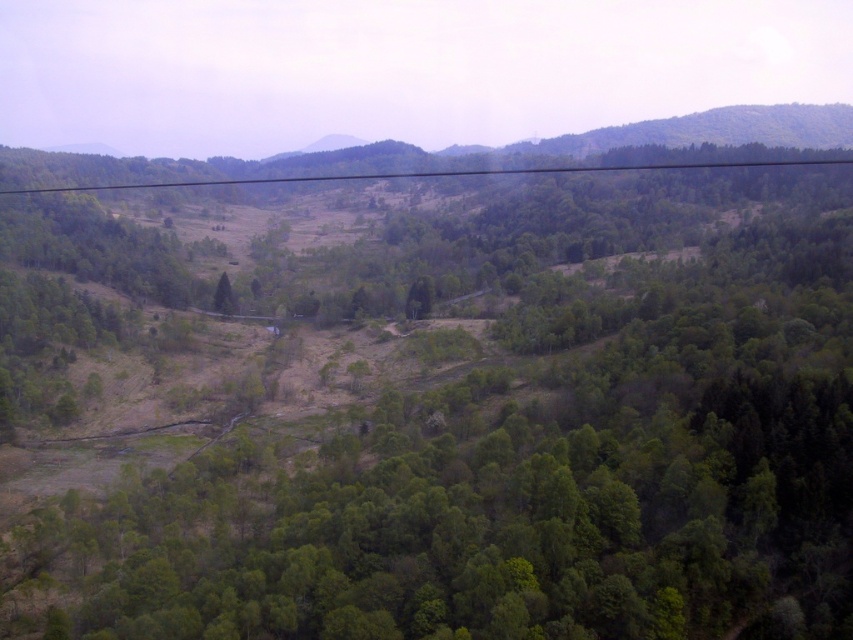
You are an observer standing in the middle of the hilly landscape. You notice a black wire at upper center and a green leafy tree at center. Which object is higher in the image?

The black wire at upper center is taller than the green leafy tree at center.

You are standing at the point labeled point (437, 173) in the image. What object are you standing on?

The point labeled point (437, 173) is on the black wire at upper center, so you are standing on the black wire at upper center.